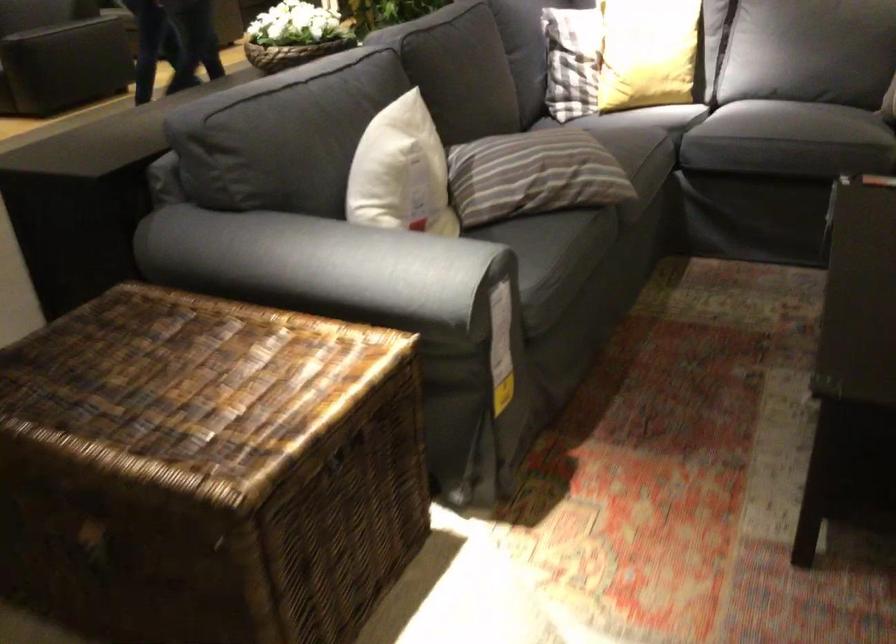
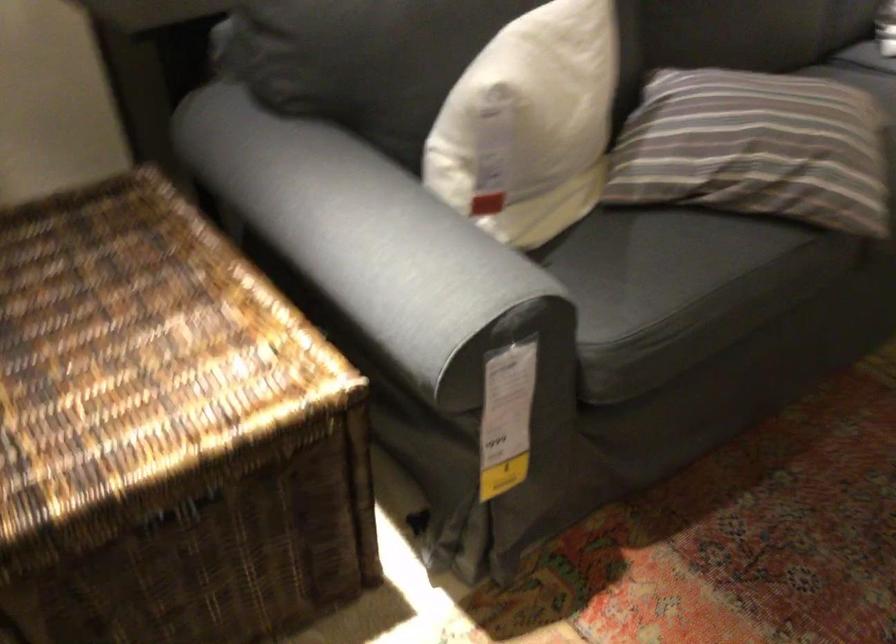
Question: How did the camera likely rotate?

Choices:
 (A) Left
 (B) Right
 (C) Up
 (D) Down

Answer: (A)